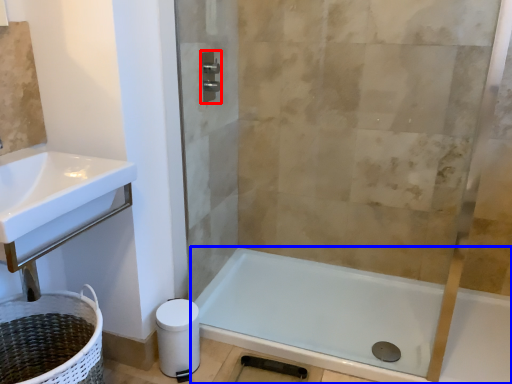
Question: Which of the following is the farthest to the observer, towel bar (highlighted by a red box) or bathtub (highlighted by a blue box)?

Choices:
 (A) towel bar
 (B) bathtub

Answer: (A)